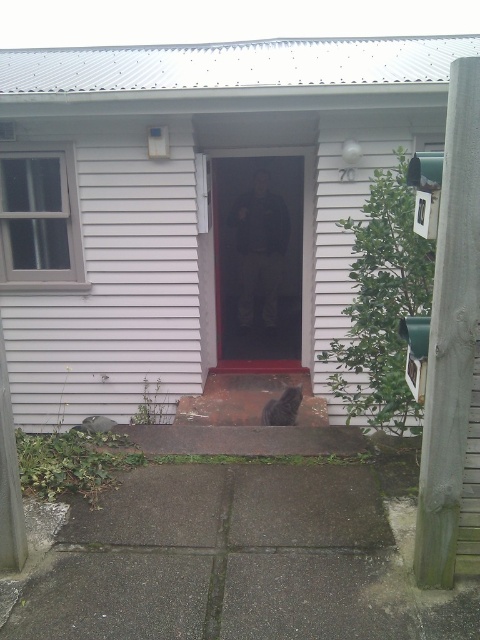
Question: Which point appears farthest from the camera in this image?

Choices:
 (A) (288, 392)
 (B) (227, 305)

Answer: (B)

Question: Which point is farther to the camera?

Choices:
 (A) transparent plastic screen door at center
 (B) black fur cat at center

Answer: (A)

Question: Is transparent plastic screen door at center below black fur cat at center?

Choices:
 (A) no
 (B) yes

Answer: (A)

Question: Which point appears closest to the camera in this image?

Choices:
 (A) (242, 193)
 (B) (295, 396)

Answer: (B)

Question: Is transparent plastic screen door at center positioned at the back of black fur cat at center?

Choices:
 (A) yes
 (B) no

Answer: (A)

Question: Observing the image, what is the correct spatial positioning of transparent plastic screen door at center in reference to black fur cat at center?

Choices:
 (A) right
 (B) left

Answer: (B)